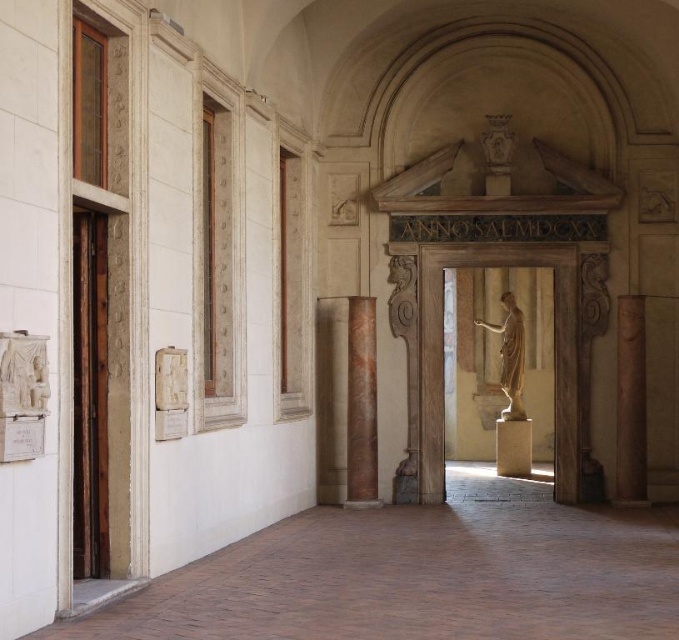
Can you confirm if brown polished stone column at right is positioned to the right of matte gold statue at center?

Yes, brown polished stone column at right is to the right of matte gold statue at center.

This screenshot has height=640, width=679. What do you see at coordinates (629, 403) in the screenshot?
I see `brown polished stone column at right` at bounding box center [629, 403].

You are a GUI agent. You are given a task and a screenshot of the screen. Output one action in this format:
    pyautogui.click(x=<x>, y=<y>)
    Task: Click on the brown polished stone column at right
    The width and height of the screenshot is (679, 640).
    Given the screenshot: What is the action you would take?
    pyautogui.click(x=629, y=403)

Does brown polished stone column at right have a lesser width compared to white marble statue at left?

No.

Does point (629, 499) come farther from viewer compared to point (24, 381)?

Yes, point (629, 499) is farther from viewer.

Where is `brown polished stone column at right`? The height and width of the screenshot is (640, 679). brown polished stone column at right is located at coordinates (629, 403).

Between brown polished stone column at right and marble column at center, which one is positioned lower?

marble column at center is lower down.

Based on the photo, who is more forward, (634,460) or (365,440)?

Point (634,460)

Between point (646, 483) and point (350, 348), which one is positioned in front?

Point (646, 483)

You are a GUI agent. You are given a task and a screenshot of the screen. Output one action in this format:
    pyautogui.click(x=<x>, y=<y>)
    Task: Click on the brown polished stone column at right
    
    Given the screenshot: What is the action you would take?
    pyautogui.click(x=629, y=403)